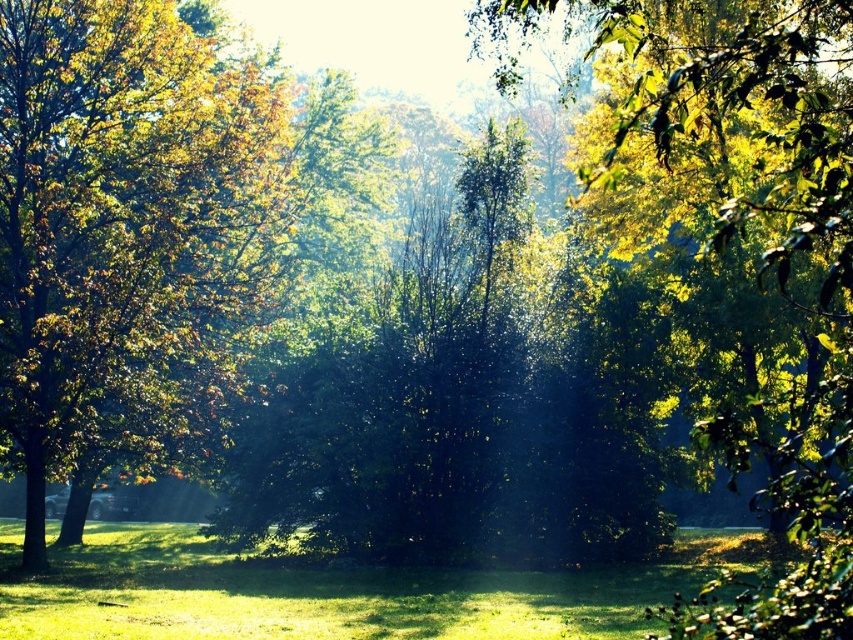
Question: Is the position of green leafy tree at left less distant than that of green grass at center?

Choices:
 (A) no
 (B) yes

Answer: (A)

Question: Which of the following is the farthest from the observer?

Choices:
 (A) green leafy tree at left
 (B) green grass at center

Answer: (A)

Question: Which point appears closest to the camera in this image?

Choices:
 (A) (263, 620)
 (B) (38, 81)

Answer: (A)

Question: Is green leafy tree at left to the left of green grass at center from the viewer's perspective?

Choices:
 (A) yes
 (B) no

Answer: (A)

Question: Does green leafy tree at left appear on the left side of green grass at center?

Choices:
 (A) yes
 (B) no

Answer: (A)